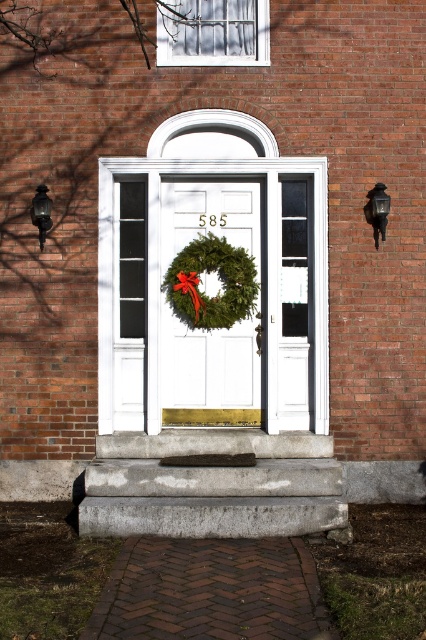
Question: Is white matte door at center thinner than matte black lantern at left?

Choices:
 (A) yes
 (B) no

Answer: (B)

Question: Which object is positioned closest to the white matte door at center?

Choices:
 (A) matte black lamp at right
 (B) green matte wreath at center
 (C) matte black lantern at left

Answer: (B)

Question: Which object appears closest to the camera in this image?

Choices:
 (A) matte black lamp at right
 (B) white matte door at center
 (C) matte black lantern at left

Answer: (A)

Question: Considering the real-world distances, which object is farthest from the gray concrete stairs at lower center?

Choices:
 (A) matte black lantern at left
 (B) white matte door at center
 (C) green matte wreath at center
 (D) matte black lamp at right

Answer: (A)

Question: Where is white matte door at center located in relation to matte black lantern at left in the image?

Choices:
 (A) below
 (B) above

Answer: (A)

Question: Is white matte door at center to the left of matte black lantern at left from the viewer's perspective?

Choices:
 (A) no
 (B) yes

Answer: (A)